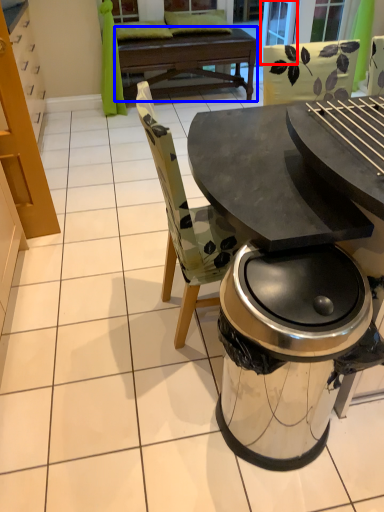
Question: Which object is further to the camera taking this photo, screen door (highlighted by a red box) or round table (highlighted by a blue box)?

Choices:
 (A) screen door
 (B) round table

Answer: (A)